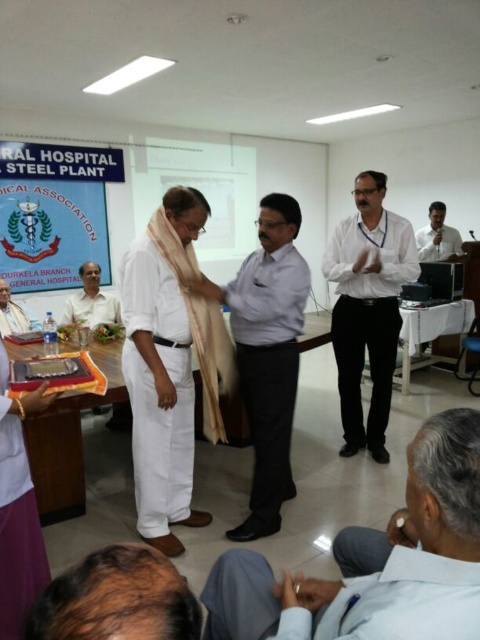
You are attending this event and want to take a photo of the presenter. The camera you have can only focus on objects within a certain height range. The white cloth at center and the matte white shirt at center are in the frame. Which object should you adjust your focus to prioritize if you want to capture the presenter clearly?

The white cloth at center is much taller than the matte white shirt at center. To capture the presenter clearly, focus on the white cloth at center since it is taller and likely part of the presenter.

You are a photographer at this event and need to capture a photo of both the white cotton dhoti at center and the light brown shirt at upper right in the same frame. Based on their positions, which one is located to the left of the other?

The white cotton dhoti at center is positioned on the left side of light brown shirt at upper right.

What are the coordinates of the white cotton dhoti at center in the image?

The white cotton dhoti at center is located at coordinates (169, 365).